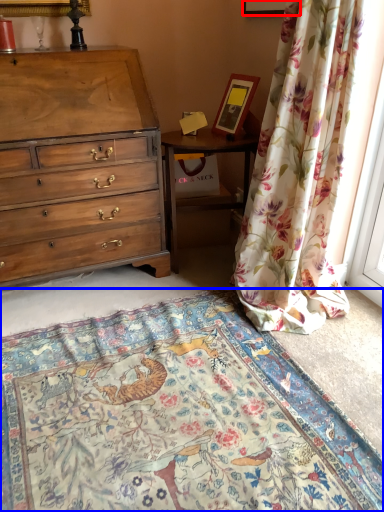
Question: Which point is further to the camera, picture frame (highlighted by a red box) or mat (highlighted by a blue box)?

Choices:
 (A) picture frame
 (B) mat

Answer: (A)